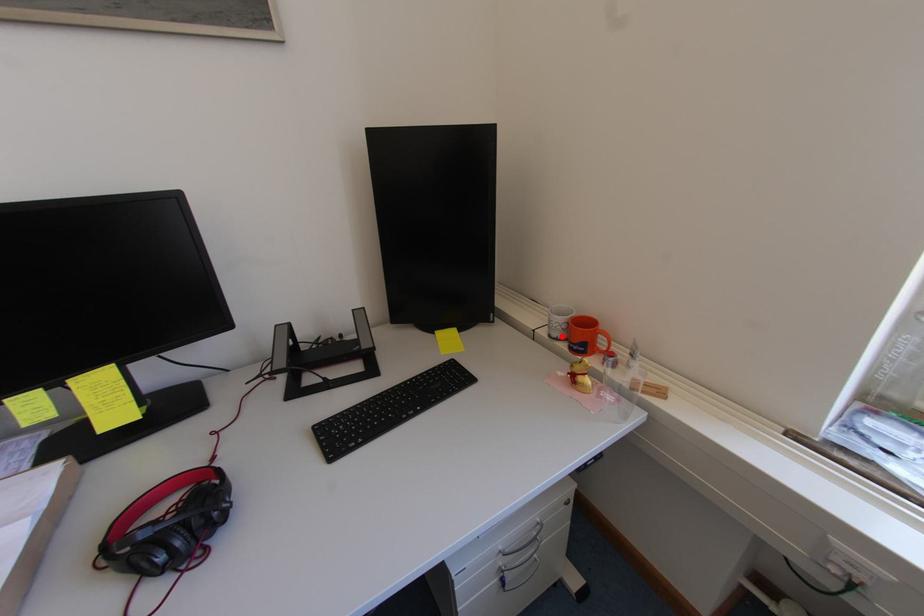
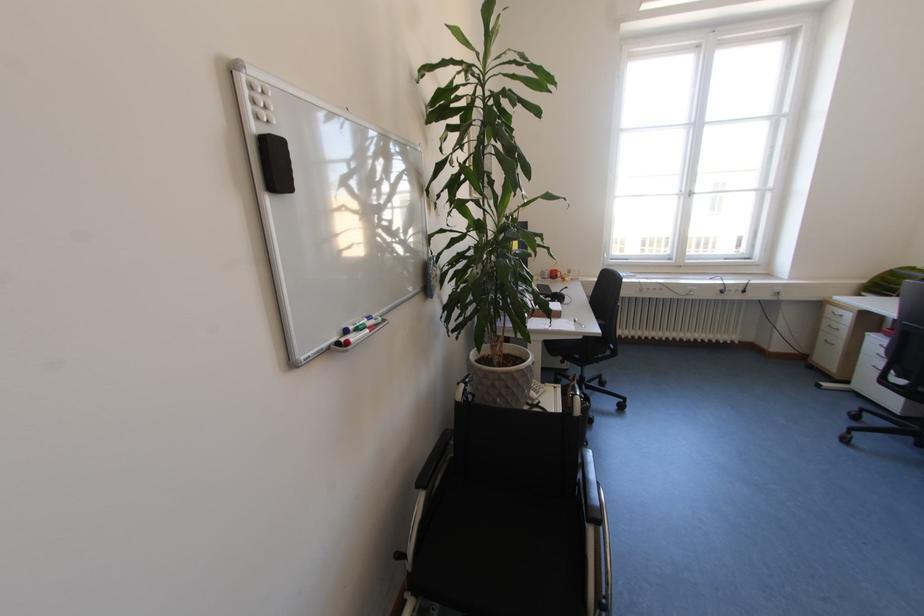
In the second image, find the point that corresponds to the highlighted location in the first image.

(553, 278)